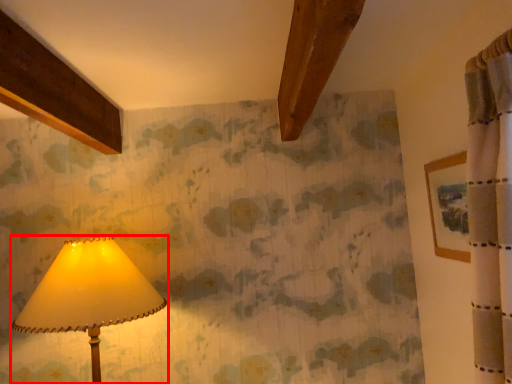
Question: From the image, what is the correct spatial relationship of lamp (annotated by the red box) in relation to picture frame?

Choices:
 (A) left
 (B) right

Answer: (A)